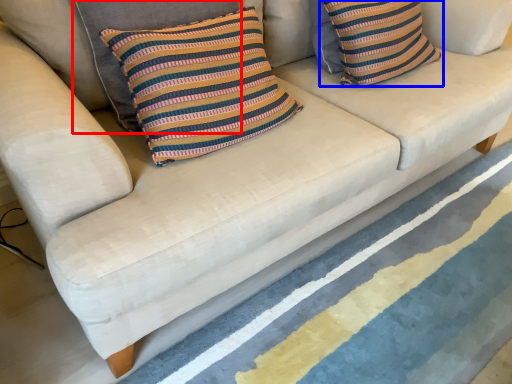
Question: Which of the following is the closest to the observer, pillow (highlighted by a red box) or pillow (highlighted by a blue box)?

Choices:
 (A) pillow
 (B) pillow

Answer: (A)